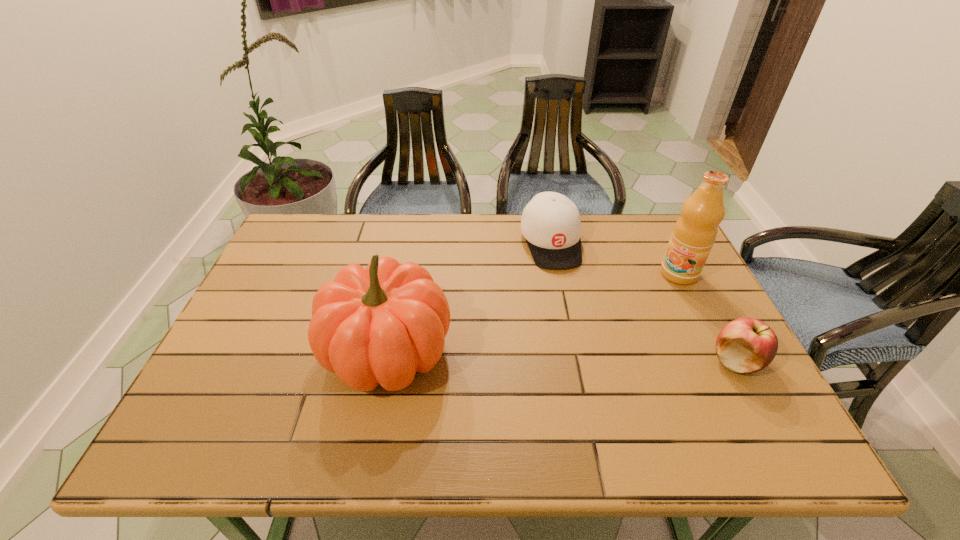
The width and height of the screenshot is (960, 540). What are the coordinates of `free space located on the front-facing side of the baseball cap` in the screenshot? It's located at (570, 303).

Where is `free region located 0.210m on the front label of the fruit juice`? free region located 0.210m on the front label of the fruit juice is located at coordinates (630, 321).

Locate an element on the screen. The image size is (960, 540). free spot located 0.370m on the front label of the fruit juice is located at coordinates (594, 355).

Identify the location of vacant region located 0.080m on the front label of the fruit juice. This screenshot has height=540, width=960. (656, 296).

Locate an element on the screen. The width and height of the screenshot is (960, 540). object at the far edge is located at coordinates (551, 225).

What are the coordinates of `pumpkin that is at the near edge` in the screenshot? It's located at (380, 325).

Where is `apple positioned at the near edge`? apple positioned at the near edge is located at coordinates (745, 345).

Where is `apple positioned at the right edge`? This screenshot has width=960, height=540. apple positioned at the right edge is located at coordinates (745, 345).

Identify the location of fruit juice present at the right edge. (695, 232).

This screenshot has height=540, width=960. In order to click on object situated at the near right corner in this screenshot , I will do `click(745, 345)`.